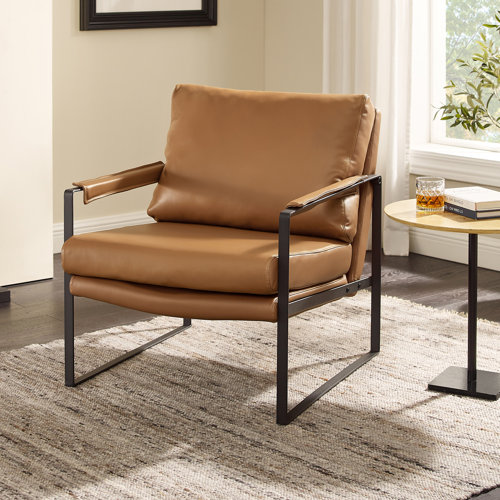
The height and width of the screenshot is (500, 500). Identify the location of part of potted plant. (488, 62).